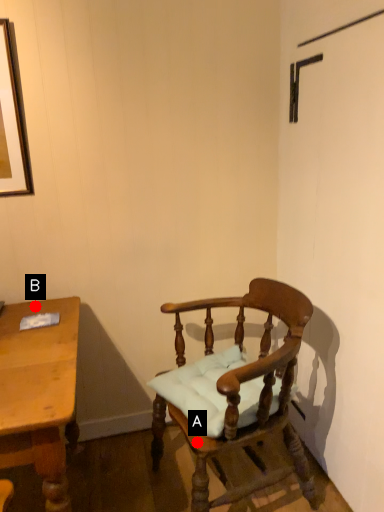
Question: Two points are circled on the image, labeled by A and B beside each circle. Which point is closer to the camera?

Choices:
 (A) A is closer
 (B) B is closer

Answer: (A)